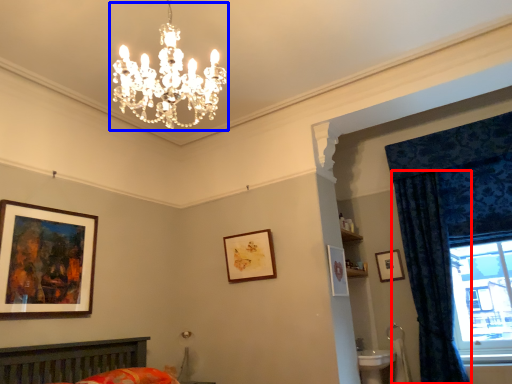
Question: Which point is closer to the camera, curtain (highlighted by a red box) or light fixture (highlighted by a blue box)?

Choices:
 (A) curtain
 (B) light fixture

Answer: (B)